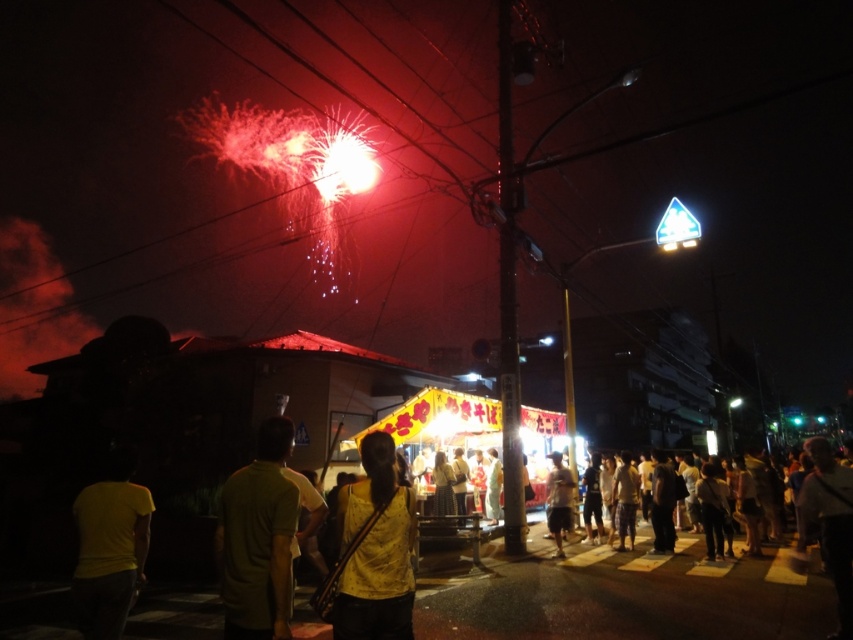
Can you confirm if yellow matte shirt at center is positioned to the left of light brown fabric pants at center?

Correct, you'll find yellow matte shirt at center to the left of light brown fabric pants at center.

Which is in front, point (386, 540) or point (569, 529)?

Point (386, 540)

Locate an element on the screen. yellow matte shirt at center is located at coordinates (375, 548).

Does yellow matte shirt at lower left appear under light brown fabric pants at center?

No, yellow matte shirt at lower left is not below light brown fabric pants at center.

Who is more forward, (82, 628) or (561, 556)?

Point (82, 628) is in front.

Where is `yellow matte shirt at lower left`? yellow matte shirt at lower left is located at coordinates (109, 547).

Find the location of `yellow matte shirt at lower left`. yellow matte shirt at lower left is located at coordinates (109, 547).

Who is more distant from viewer, (392, 570) or (109, 451)?

The point (109, 451) is more distant.

Which is in front, point (361, 540) or point (135, 568)?

Point (361, 540) is more forward.

Where is `yellow matte shirt at center`? The width and height of the screenshot is (853, 640). yellow matte shirt at center is located at coordinates (375, 548).

You are a GUI agent. You are given a task and a screenshot of the screen. Output one action in this format:
    pyautogui.click(x=<x>, y=<y>)
    Task: Click on the yellow matte shirt at center
    This screenshot has width=853, height=640.
    Given the screenshot: What is the action you would take?
    pyautogui.click(x=375, y=548)